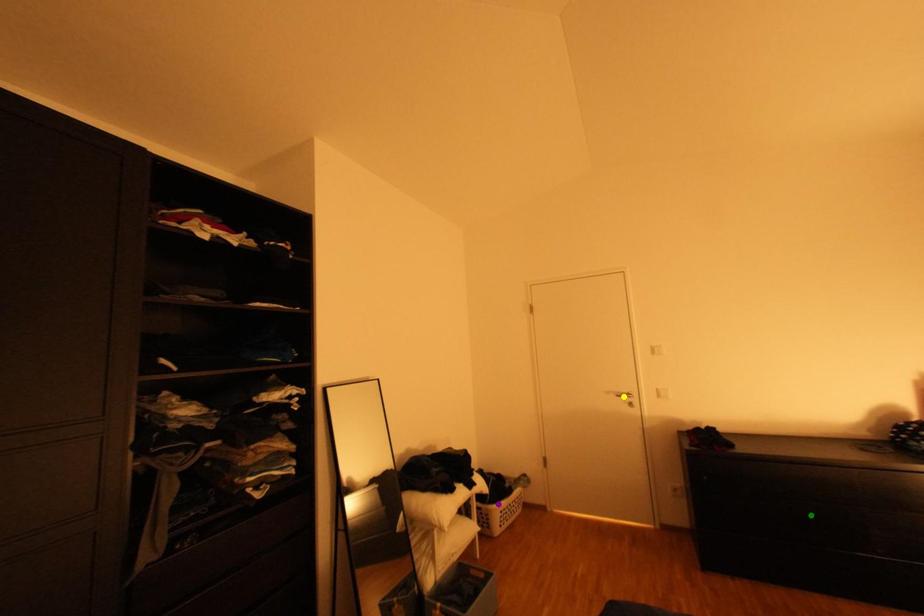
Order these from nearest to farthest:
- yellow point
- purple point
- green point

green point, purple point, yellow point